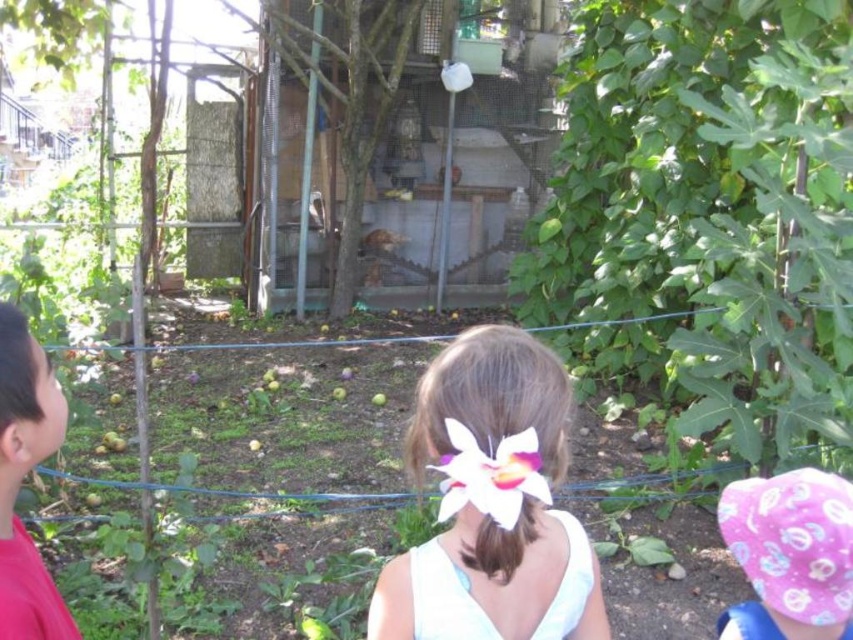
Question: Does white fabric flower at center have a smaller size compared to red shirt at left?

Choices:
 (A) no
 (B) yes

Answer: (A)

Question: Is pink fabric hat at lower right thinner than red shirt at left?

Choices:
 (A) yes
 (B) no

Answer: (B)

Question: Estimate the real-world distances between objects in this image. Which object is farther from the white matte flower at center?

Choices:
 (A) red shirt at left
 (B) white fabric flower at center

Answer: (A)

Question: Among these points, which one is farthest from the camera?

Choices:
 (A) pos(0,424)
 (B) pos(497,460)
 (C) pos(816,474)
 (D) pos(509,477)

Answer: (C)

Question: Is red shirt at left bigger than white matte flower at center?

Choices:
 (A) yes
 (B) no

Answer: (A)

Question: Which of the following is the farthest from the observer?

Choices:
 (A) (444, 490)
 (B) (489, 483)

Answer: (A)